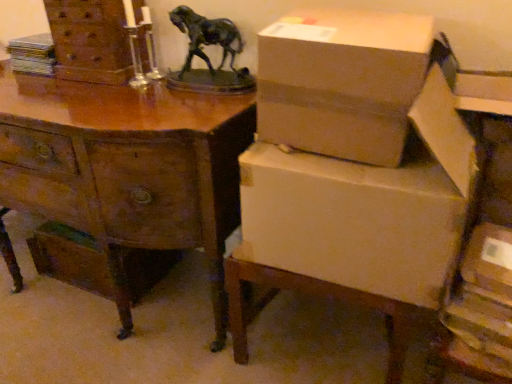
Question: Should I look upward or downward to see white cardboard box at lower right?

Choices:
 (A) up
 (B) down

Answer: (A)

Question: Is matte cardboard box at lower right shorter than wooden desk at center?

Choices:
 (A) yes
 (B) no

Answer: (A)

Question: Can you confirm if matte cardboard box at lower right is taller than wooden desk at center?

Choices:
 (A) yes
 (B) no

Answer: (B)

Question: Can you confirm if matte cardboard box at lower right is bigger than wooden desk at center?

Choices:
 (A) yes
 (B) no

Answer: (B)

Question: Is matte cardboard box at lower right directly adjacent to wooden desk at center?

Choices:
 (A) no
 (B) yes

Answer: (A)

Question: Can you confirm if matte cardboard box at lower right is positioned to the left of wooden desk at center?

Choices:
 (A) no
 (B) yes

Answer: (A)

Question: Can you confirm if matte cardboard box at lower right is smaller than wooden desk at center?

Choices:
 (A) yes
 (B) no

Answer: (A)

Question: Considering the relative sizes of matte cardboard box at lower right and cardboard box at upper right in the image provided, is matte cardboard box at lower right taller than cardboard box at upper right?

Choices:
 (A) yes
 (B) no

Answer: (B)

Question: Can you confirm if matte cardboard box at lower right is smaller than cardboard box at upper right?

Choices:
 (A) yes
 (B) no

Answer: (A)

Question: Does matte cardboard box at lower right touch cardboard box at upper right?

Choices:
 (A) no
 (B) yes

Answer: (A)

Question: Is cardboard box at upper right a part of matte cardboard box at lower right?

Choices:
 (A) yes
 (B) no

Answer: (B)

Question: Is matte cardboard box at lower right looking in the opposite direction of cardboard box at upper right?

Choices:
 (A) no
 (B) yes

Answer: (A)

Question: Is matte cardboard box at lower right not close to cardboard box at upper right?

Choices:
 (A) yes
 (B) no

Answer: (B)

Question: Can you see wooden desk at center touching wooden chest of drawers at upper left?

Choices:
 (A) no
 (B) yes

Answer: (A)